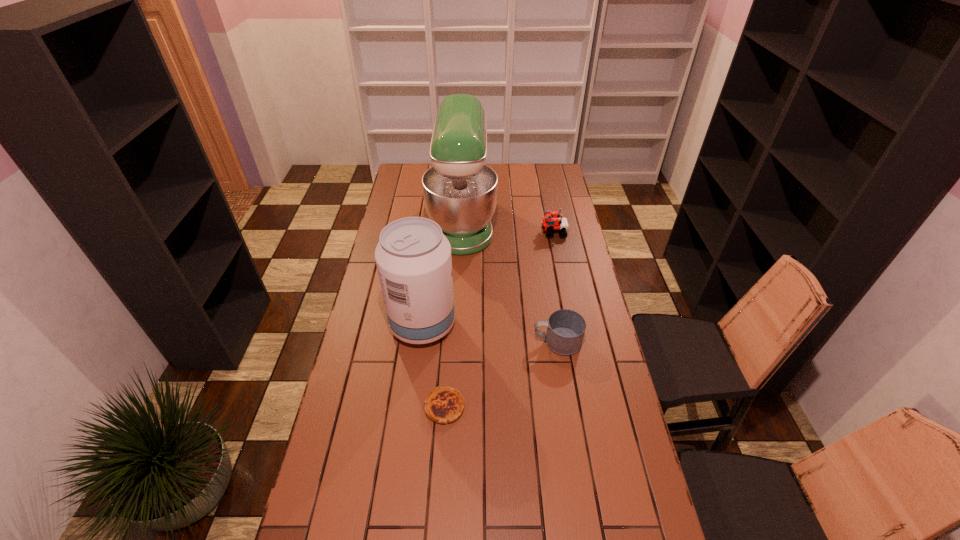
This screenshot has width=960, height=540. In order to click on free space located 0.290m on the front-facing side of the Lego in this screenshot , I will do `click(478, 233)`.

Identify the location of free space located 0.290m on the side of the mug with the handle. The image size is (960, 540). (451, 342).

The height and width of the screenshot is (540, 960). I want to click on free space located 0.290m on the side of the mug with the handle, so click(x=451, y=342).

This screenshot has height=540, width=960. Identify the location of free space located 0.400m on the side of the mug with the handle. (420, 342).

You are a GUI agent. You are given a task and a screenshot of the screen. Output one action in this format:
    pyautogui.click(x=<x>, y=<y>)
    Task: Click on the free space located 0.310m on the front of the nearest object
    This screenshot has width=960, height=540.
    Given the screenshot: What is the action you would take?
    pyautogui.click(x=436, y=539)

The height and width of the screenshot is (540, 960). In order to click on object that is at the left edge in this screenshot , I will do `click(413, 257)`.

The image size is (960, 540). I want to click on Lego at the right edge, so click(x=552, y=223).

Find the location of a particular element. mug that is at the right edge is located at coordinates (565, 328).

This screenshot has height=540, width=960. Identify the location of vacant space at the far edge. (508, 178).

The width and height of the screenshot is (960, 540). I want to click on vacant space at the left edge of the desktop, so click(401, 193).